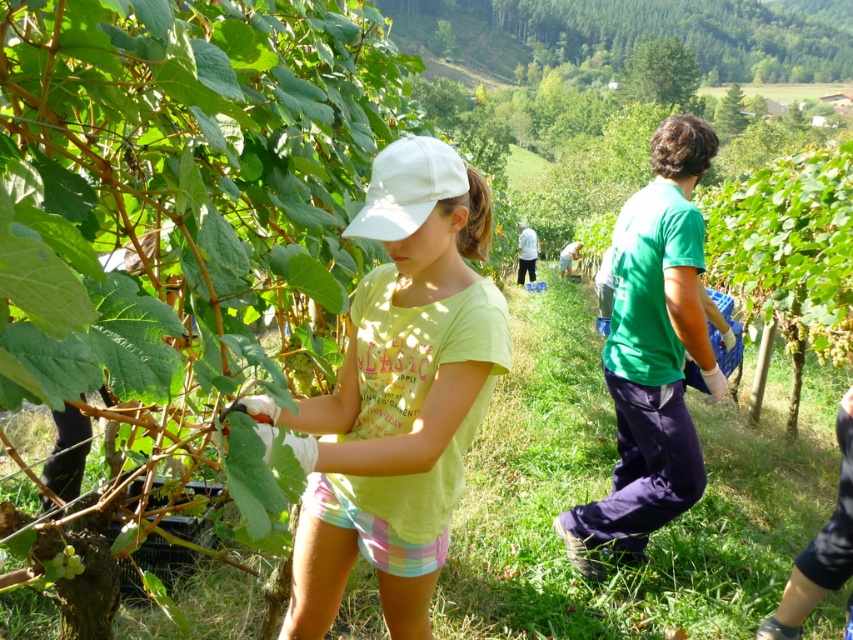
Question: Does light green cotton shirt at center appear on the left side of green matte grapes at lower left?

Choices:
 (A) yes
 (B) no

Answer: (B)

Question: Is light green cotton shirt at center positioned behind green matte grapes at lower left?

Choices:
 (A) yes
 (B) no

Answer: (B)

Question: Which point is farther from the camera taking this photo?

Choices:
 (A) (469, 180)
 (B) (74, 556)

Answer: (B)

Question: Which point is farther from the camera taking this photo?

Choices:
 (A) (73, 554)
 (B) (346, 493)

Answer: (A)

Question: Where is light green cotton shirt at center located in relation to green matte grapes at lower left in the image?

Choices:
 (A) left
 (B) right

Answer: (B)

Question: Which point is closer to the camera taking this photo?

Choices:
 (A) (68, 552)
 (B) (358, 324)

Answer: (B)